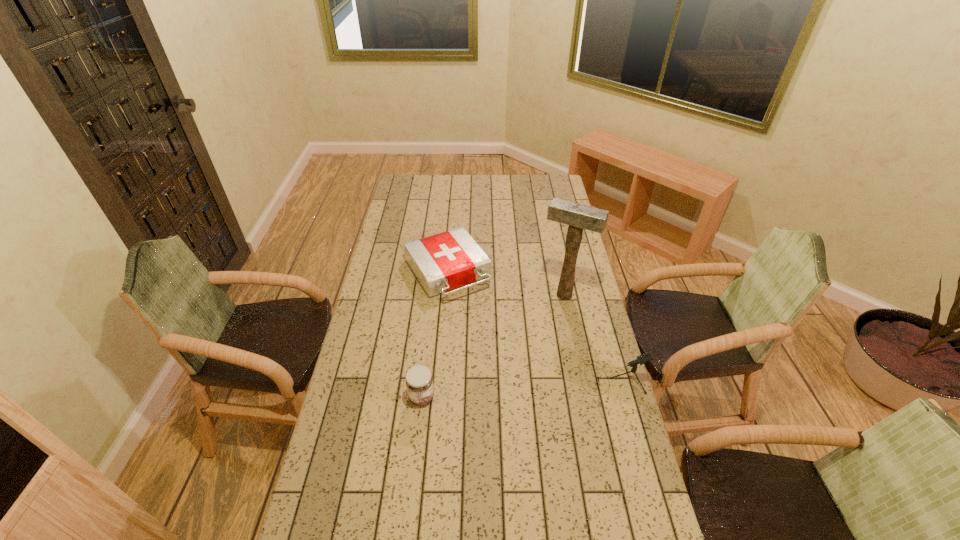
This screenshot has width=960, height=540. I want to click on jam, so click(x=419, y=381).

Where is `microphone`? The image size is (960, 540). microphone is located at coordinates (646, 357).

The image size is (960, 540). What are the coordinates of `the first-aid kit` in the screenshot? It's located at (445, 261).

Find the location of `the tallest object`. the tallest object is located at coordinates (578, 217).

I want to click on vacant space located 0.060m on the front label of the jam, so click(x=453, y=397).

What are the coordinates of `free spot located on the stand of the microphone` in the screenshot? It's located at (499, 377).

Find the location of a particular element. The height and width of the screenshot is (540, 960). vacant space positioned on the stand of the microphone is located at coordinates (484, 377).

At what (x,y) coordinates should I click in order to perform the action: click on free location located on the stand of the microphone. Please return your answer as a coordinate pair (x, y). Image resolution: width=960 pixels, height=540 pixels. Looking at the image, I should click on (551, 377).

You are a GUI agent. You are given a task and a screenshot of the screen. Output one action in this format:
    pyautogui.click(x=<x>, y=<y>)
    Task: Click on the free space located on the front side of the shortest object
    The image size is (960, 540).
    Given the screenshot: What is the action you would take?
    pyautogui.click(x=510, y=366)

The image size is (960, 540). In order to click on vacant space located on the front side of the shortest object in this screenshot , I will do `click(475, 316)`.